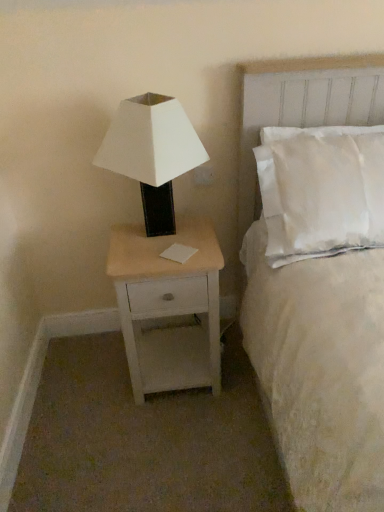
Where is `vacant region under white matte/black base lamp at left (from a real-world perspective)`? The image size is (384, 512). vacant region under white matte/black base lamp at left (from a real-world perspective) is located at coordinates (162, 240).